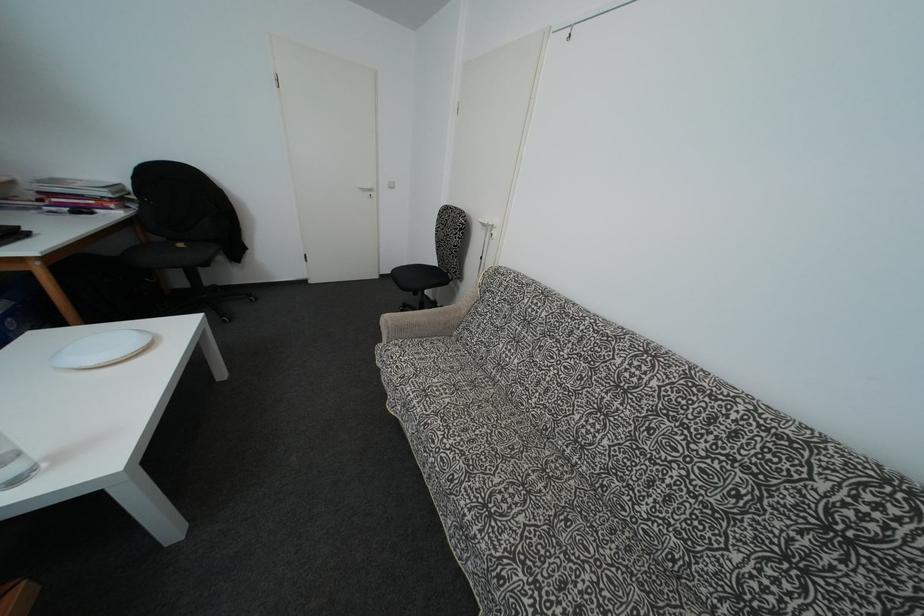
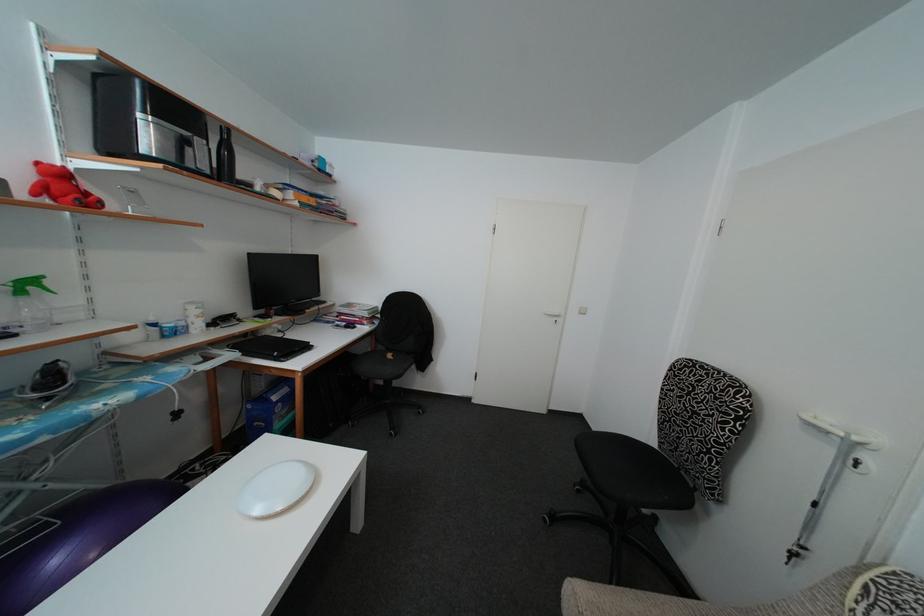
The images are taken continuously from a first-person perspective. In which direction is your viewpoint rotating?

The camera rotated toward left-up.